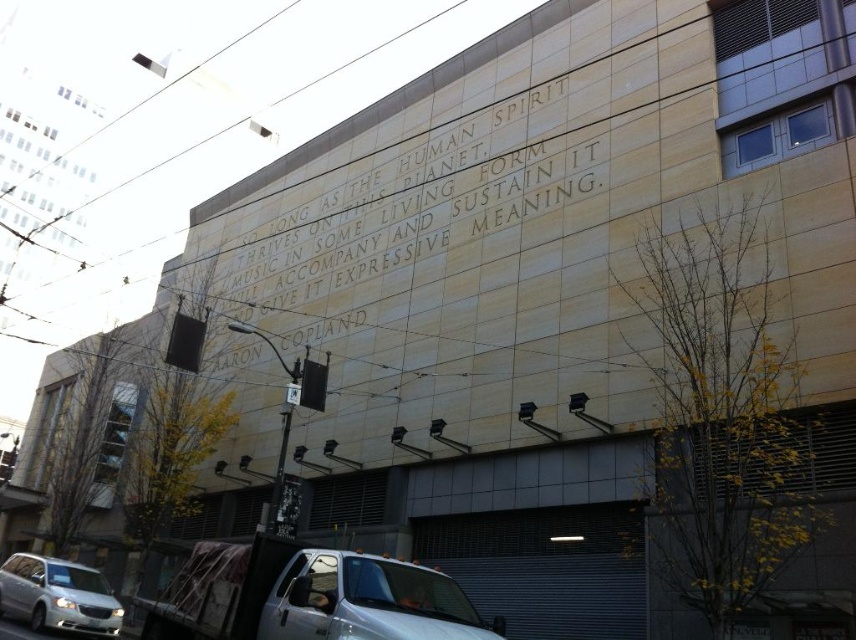
You are a photographer trying to capture both the white glossy truck at lower center and the stone engraving at center in a single frame. Given their sizes, which object would you need to position closer to the camera to ensure both are clearly visible?

Since the white glossy truck at lower center is smaller than the stone engraving at center, you should position the white glossy truck at lower center closer to the camera to balance their sizes in the frame.